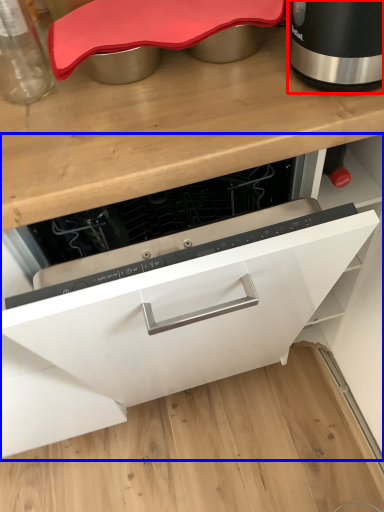
Question: Among these objects, which one is farthest to the camera, home appliance (highlighted by a red box) or cabinetry (highlighted by a blue box)?

Choices:
 (A) home appliance
 (B) cabinetry

Answer: (A)